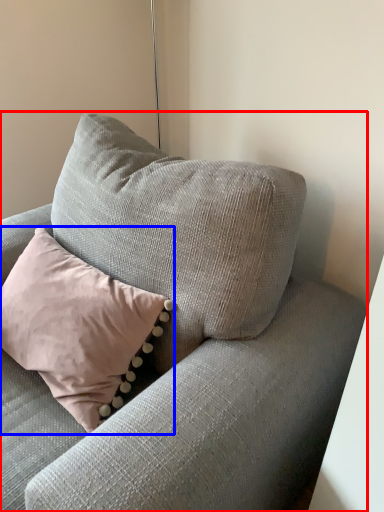
Question: Which of the following is the closest to the observer, studio couch (highlighted by a red box) or pillow (highlighted by a blue box)?

Choices:
 (A) studio couch
 (B) pillow

Answer: (A)